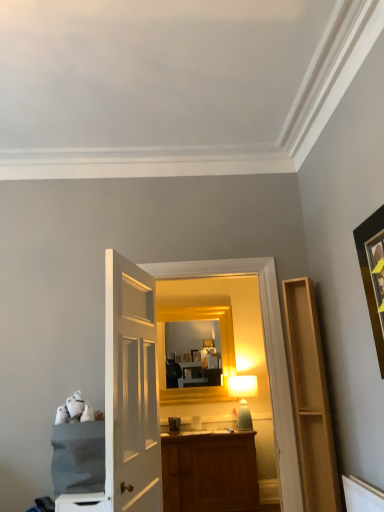
This screenshot has width=384, height=512. Describe the element at coordinates (78, 457) in the screenshot. I see `denim fabric cabinet at left, the first cabinetry when ordered from left to right` at that location.

What do you see at coordinates (243, 397) in the screenshot? The image size is (384, 512). I see `matte white table lamp at center` at bounding box center [243, 397].

This screenshot has width=384, height=512. What are the coordinates of `black matte picture frame at upper right` in the screenshot? It's located at (369, 275).

From the image's perspective, relative to light wood shelf at right, acting as the 1th cabinetry starting from the right, is denim fabric cabinet at left, the second cabinetry when ordered from right to left, above or below?

denim fabric cabinet at left, the second cabinetry when ordered from right to left, is below light wood shelf at right, acting as the 1th cabinetry starting from the right.

Measure the distance between denim fabric cabinet at left, the second cabinetry when ordered from right to left, and light wood shelf at right, acting as the 2th cabinetry starting from the left.

A distance of 5.09 feet exists between denim fabric cabinet at left, the second cabinetry when ordered from right to left, and light wood shelf at right, acting as the 2th cabinetry starting from the left.

Is denim fabric cabinet at left, the first cabinetry when ordered from left to right, taller or shorter than light wood shelf at right, acting as the 2th cabinetry starting from the left?

Considering their sizes, denim fabric cabinet at left, the first cabinetry when ordered from left to right, has less height than light wood shelf at right, acting as the 2th cabinetry starting from the left.

In terms of width, does denim fabric cabinet at left, the second cabinetry when ordered from right to left, look wider or thinner when compared to light wood shelf at right, acting as the 1th cabinetry starting from the right?

denim fabric cabinet at left, the second cabinetry when ordered from right to left, is wider than light wood shelf at right, acting as the 1th cabinetry starting from the right.

Is black matte picture frame at upper right turned away from matte white table lamp at center?

black matte picture frame at upper right is not turned away from matte white table lamp at center.

From the image's perspective, which is below, black matte picture frame at upper right or matte white table lamp at center?

matte white table lamp at center is shown below in the image.

Is black matte picture frame at upper right next to matte white table lamp at center?

No, black matte picture frame at upper right is not beside matte white table lamp at center.

Which of these two, black matte picture frame at upper right or matte white table lamp at center, is smaller?

Smaller between the two is black matte picture frame at upper right.

Who is smaller, light wood shelf at right, acting as the 1th cabinetry starting from the right, or matte white table lamp at center?

With smaller size is matte white table lamp at center.

Which is correct: light wood shelf at right, acting as the 2th cabinetry starting from the left, is inside matte white table lamp at center, or outside of it?

light wood shelf at right, acting as the 2th cabinetry starting from the left, is not inside matte white table lamp at center, it's outside.

How different are the orientations of light wood shelf at right, acting as the 1th cabinetry starting from the right, and matte white table lamp at center in degrees?

They differ by 31.7 degrees in their facing directions.

Considering the positions of objects light wood shelf at right, acting as the 1th cabinetry starting from the right, and matte white table lamp at center in the image provided, who is behind, light wood shelf at right, acting as the 1th cabinetry starting from the right, or matte white table lamp at center?

matte white table lamp at center.

Is matte white table lamp at center facing towards light wood shelf at right, acting as the 1th cabinetry starting from the right?

Yes, matte white table lamp at center faces towards light wood shelf at right, acting as the 1th cabinetry starting from the right.

Find the location of a particular element. cabinetry on the right of matte white table lamp at center is located at coordinates (311, 398).

Measure the distance between matte white table lamp at center and light wood shelf at right, acting as the 2th cabinetry starting from the left.

matte white table lamp at center is 1.53 meters from light wood shelf at right, acting as the 2th cabinetry starting from the left.

From a real-world perspective, is matte white table lamp at center below light wood shelf at right, acting as the 1th cabinetry starting from the right?

Correct, in the physical world, matte white table lamp at center is lower than light wood shelf at right, acting as the 1th cabinetry starting from the right.

Is black matte picture frame at upper right taller than light wood shelf at right, acting as the 2th cabinetry starting from the left?

Incorrect, the height of black matte picture frame at upper right is not larger of that of light wood shelf at right, acting as the 2th cabinetry starting from the left.

Identify the location of the 2nd cabinetry behind when counting from the black matte picture frame at upper right. Image resolution: width=384 pixels, height=512 pixels. (311, 398).

Is black matte picture frame at upper right wider than light wood shelf at right, acting as the 2th cabinetry starting from the left?

Incorrect, the width of black matte picture frame at upper right does not surpass that of light wood shelf at right, acting as the 2th cabinetry starting from the left.

Is black matte picture frame at upper right closer to camera compared to light wood shelf at right, acting as the 1th cabinetry starting from the right?

That is True.

How far apart are light wood shelf at right, acting as the 1th cabinetry starting from the right, and denim fabric cabinet at left, the second cabinetry when ordered from right to left?

A distance of 1.55 meters exists between light wood shelf at right, acting as the 1th cabinetry starting from the right, and denim fabric cabinet at left, the second cabinetry when ordered from right to left.

Can you tell me how much light wood shelf at right, acting as the 2th cabinetry starting from the left, and denim fabric cabinet at left, the first cabinetry when ordered from left to right, differ in facing direction?

The angular difference between light wood shelf at right, acting as the 2th cabinetry starting from the left, and denim fabric cabinet at left, the first cabinetry when ordered from left to right, is 0.119 degrees.

From a real-world perspective, is light wood shelf at right, acting as the 1th cabinetry starting from the right, positioned above or below denim fabric cabinet at left, the first cabinetry when ordered from left to right?

Clearly, from a real-world perspective, light wood shelf at right, acting as the 1th cabinetry starting from the right, is above denim fabric cabinet at left, the first cabinetry when ordered from left to right.

Is light wood shelf at right, acting as the 1th cabinetry starting from the right, next to denim fabric cabinet at left, the second cabinetry when ordered from right to left?

No, light wood shelf at right, acting as the 1th cabinetry starting from the right, is not in contact with denim fabric cabinet at left, the second cabinetry when ordered from right to left.

From the image's perspective, is denim fabric cabinet at left, the first cabinetry when ordered from left to right, on top of black matte picture frame at upper right?

No.

Who is shorter, denim fabric cabinet at left, the first cabinetry when ordered from left to right, or black matte picture frame at upper right?

With less height is denim fabric cabinet at left, the first cabinetry when ordered from left to right.

Considering the positions of objects denim fabric cabinet at left, the first cabinetry when ordered from left to right, and black matte picture frame at upper right in the image provided, who is in front, denim fabric cabinet at left, the first cabinetry when ordered from left to right, or black matte picture frame at upper right?

black matte picture frame at upper right.

Based on the photo, could you tell me if denim fabric cabinet at left, the second cabinetry when ordered from right to left, is turned towards black matte picture frame at upper right?

No, denim fabric cabinet at left, the second cabinetry when ordered from right to left, is not facing towards black matte picture frame at upper right.

The height and width of the screenshot is (512, 384). Find the location of `cabinetry that is above the denim fabric cabinet at left, the second cabinetry when ordered from right to left (from a real-world perspective)`. cabinetry that is above the denim fabric cabinet at left, the second cabinetry when ordered from right to left (from a real-world perspective) is located at coordinates (311, 398).

Identify the location of table lamp lying behind the black matte picture frame at upper right. This screenshot has width=384, height=512. (x=243, y=397).

Based on their spatial positions, is black matte picture frame at upper right or denim fabric cabinet at left, the first cabinetry when ordered from left to right, closer to light wood shelf at right, acting as the 1th cabinetry starting from the right?

black matte picture frame at upper right is positioned closer to the anchor light wood shelf at right, acting as the 1th cabinetry starting from the right.

Looking at the image, which one is located further to matte white table lamp at center, light wood shelf at right, acting as the 2th cabinetry starting from the left, or denim fabric cabinet at left, the first cabinetry when ordered from left to right?

The object further to matte white table lamp at center is denim fabric cabinet at left, the first cabinetry when ordered from left to right.

When comparing their distances from black matte picture frame at upper right, does matte white table lamp at center or light wood shelf at right, acting as the 1th cabinetry starting from the right, seem further?

Among the two, matte white table lamp at center is located further to black matte picture frame at upper right.

Estimate the real-world distances between objects in this image. Which object is further from matte white table lamp at center, light wood shelf at right, acting as the 2th cabinetry starting from the left, or black matte picture frame at upper right?

Among the two, black matte picture frame at upper right is located further to matte white table lamp at center.

Looking at the image, which one is located closer to black matte picture frame at upper right, denim fabric cabinet at left, the second cabinetry when ordered from right to left, or light wood shelf at right, acting as the 2th cabinetry starting from the left?

light wood shelf at right, acting as the 2th cabinetry starting from the left, is closer to black matte picture frame at upper right.

Based on their spatial positions, is matte white table lamp at center or black matte picture frame at upper right further from denim fabric cabinet at left, the second cabinetry when ordered from right to left?

matte white table lamp at center.

Looking at the image, which one is located closer to denim fabric cabinet at left, the first cabinetry when ordered from left to right, light wood shelf at right, acting as the 2th cabinetry starting from the left, or black matte picture frame at upper right?

The object closer to denim fabric cabinet at left, the first cabinetry when ordered from left to right, is light wood shelf at right, acting as the 2th cabinetry starting from the left.

Consider the image. Looking at the image, which one is located closer to light wood shelf at right, acting as the 2th cabinetry starting from the left, matte white table lamp at center or denim fabric cabinet at left, the second cabinetry when ordered from right to left?

matte white table lamp at center is positioned closer to the anchor light wood shelf at right, acting as the 2th cabinetry starting from the left.

What are the coordinates of `cabinetry located between denim fabric cabinet at left, the second cabinetry when ordered from right to left, and black matte picture frame at upper right in the left-right direction` in the screenshot? It's located at click(x=311, y=398).

Identify the location of cabinetry between denim fabric cabinet at left, the second cabinetry when ordered from right to left, and matte white table lamp at center, along the z-axis. (311, 398).